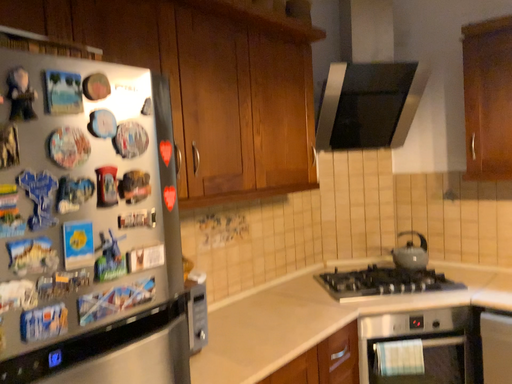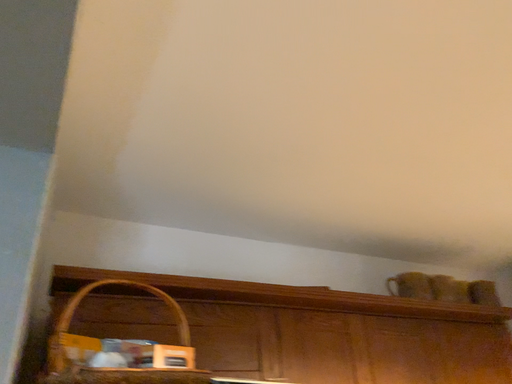
Question: How did the camera likely rotate when shooting the video?

Choices:
 (A) rotated downward
 (B) rotated upward

Answer: (B)